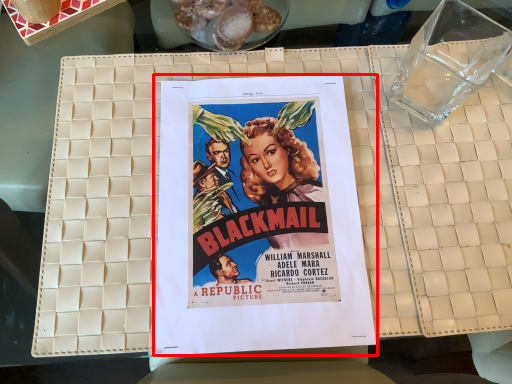
Question: From the image's perspective, where is poster (annotated by the red box) located in relation to food in the image?

Choices:
 (A) below
 (B) above

Answer: (A)